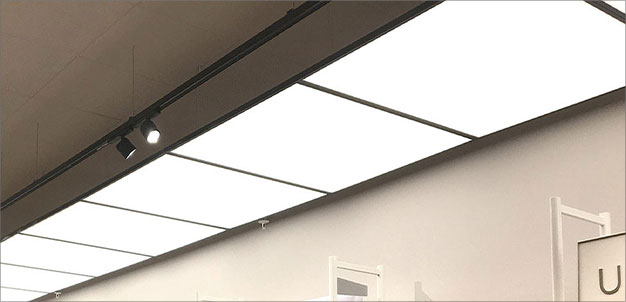
Locate an element on the screen. This screenshot has height=302, width=626. empty space below lights is located at coordinates (452, 218).